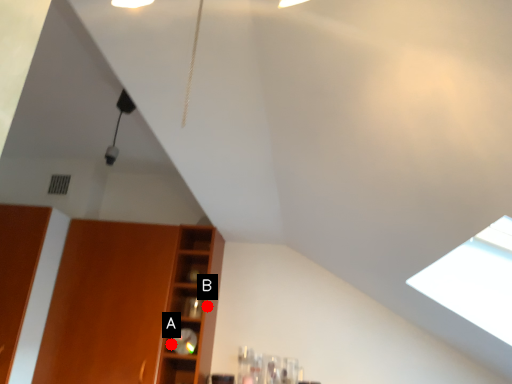
Question: Two points are circled on the image, labeled by A and B beside each circle. Which of the following is the farthest from the observer?

Choices:
 (A) A is further
 (B) B is further

Answer: (B)